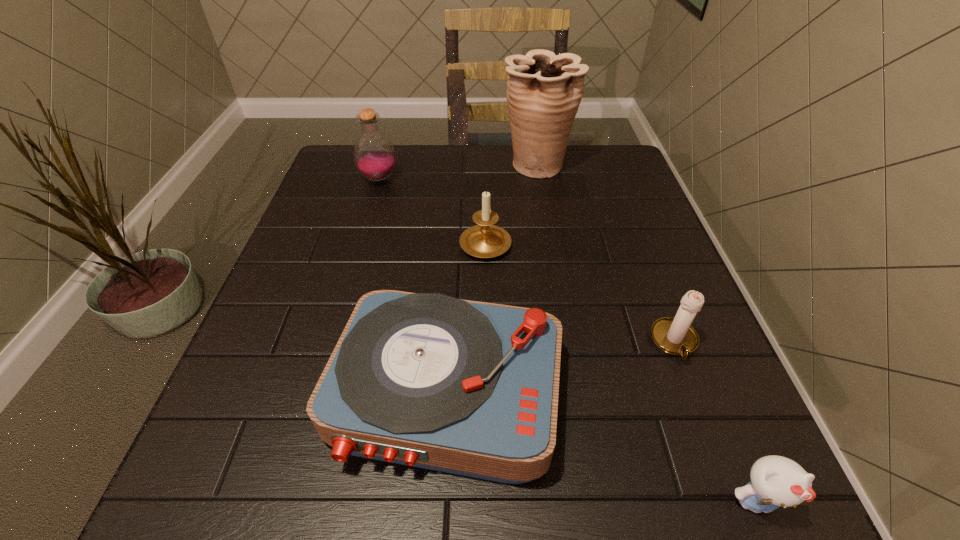
Image resolution: width=960 pixels, height=540 pixels. I want to click on unoccupied position between the right candle holder and the kitten, so click(x=714, y=422).

You are a GUI agent. You are given a task and a screenshot of the screen. Output one action in this format:
    pyautogui.click(x=<x>, y=<y>)
    Task: Click on the vacant area that lies between the second tallest object and the kitten
    Image resolution: width=960 pixels, height=540 pixels.
    Given the screenshot: What is the action you would take?
    pyautogui.click(x=566, y=341)

Identify the location of object that is the fourth closest to the kitten. (544, 91).

Locate an element on the screen. The width and height of the screenshot is (960, 540). object that is the closest to the kitten is located at coordinates (676, 336).